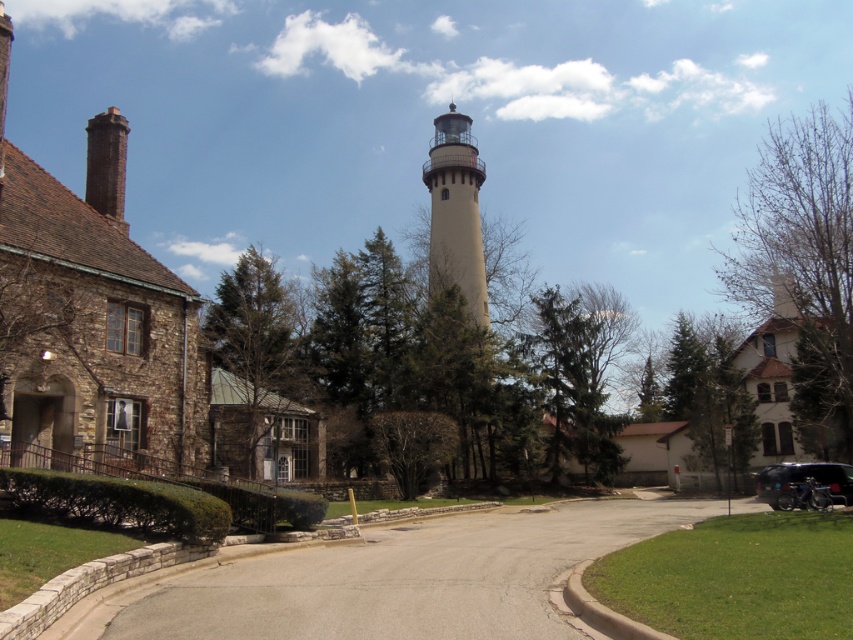
You are standing at the lighthouse and want to drive your car to the gray asphalt driveway at center. What direction should you head to reach it?

You should head towards the direction of the gray asphalt driveway at center located at point (387, 579), which is directly in front of you from the lighthouse.

You are driving a delivery van that is 2 meters wide. You see the gray asphalt driveway at center and the beige stucco tower at center in the image. Can your van fit through the driveway if the tower is in the way?

The gray asphalt driveway at center might be wider than beige stucco tower at center, so there is a possibility that the delivery van can fit through the driveway if the tower is in the way, but it depends on the exact width difference between the driveway and the tower.

Looking at this image, you are driving a car that is 5 meters long. You want to park your car between the gray asphalt driveway at center and the beige stucco tower at center. Is there enough space to park your car there?

The distance between the gray asphalt driveway at center and the beige stucco tower at center is 46.30 meters. Since your car is only 5 meters long, there is ample space to park between them.